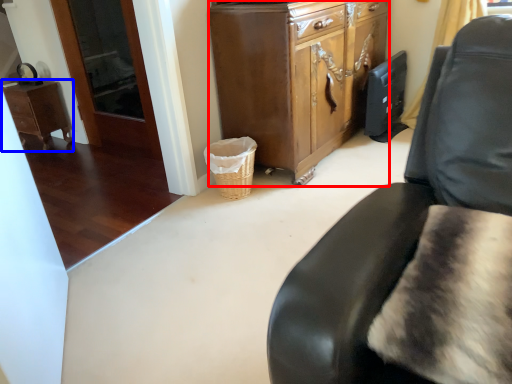
Question: Which object appears farthest to the camera in this image, cabinetry (highlighted by a red box) or desk (highlighted by a blue box)?

Choices:
 (A) cabinetry
 (B) desk

Answer: (B)